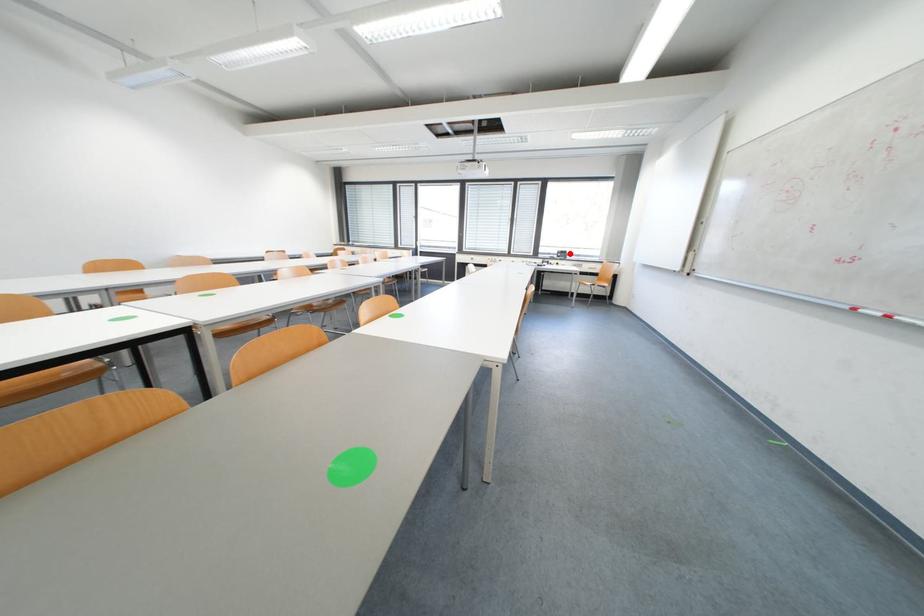
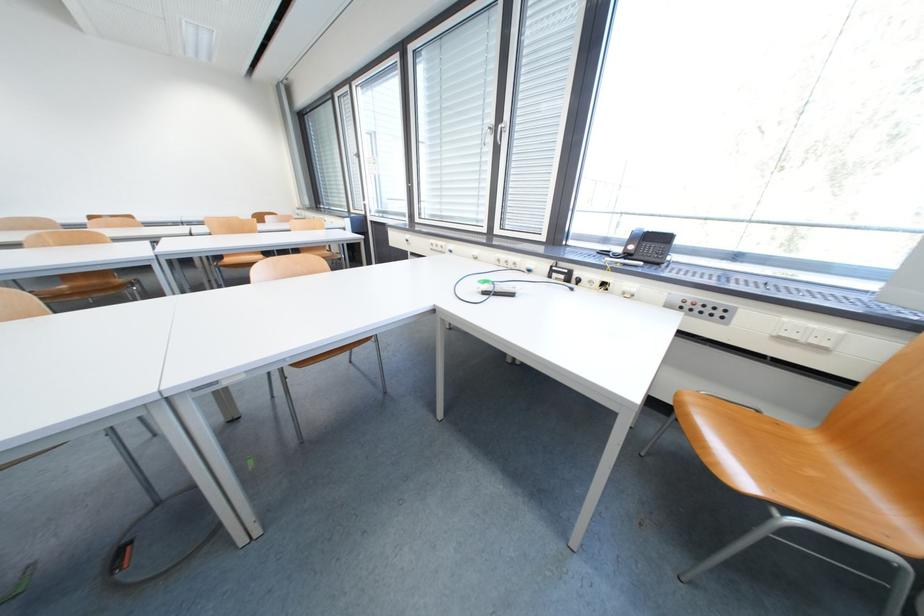
In the second image, find the point that corresponds to the highlighted location in the first image.

(670, 240)